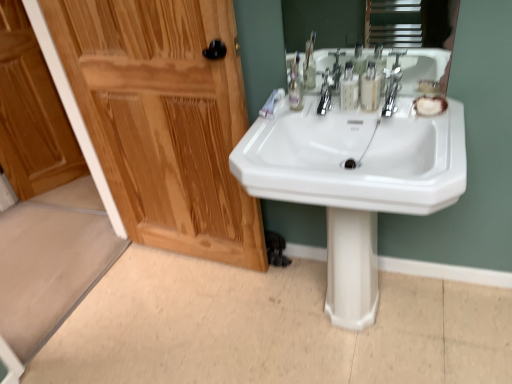
In order to click on vacant area in front of shiny wood door at left in this screenshot , I will do `click(194, 319)`.